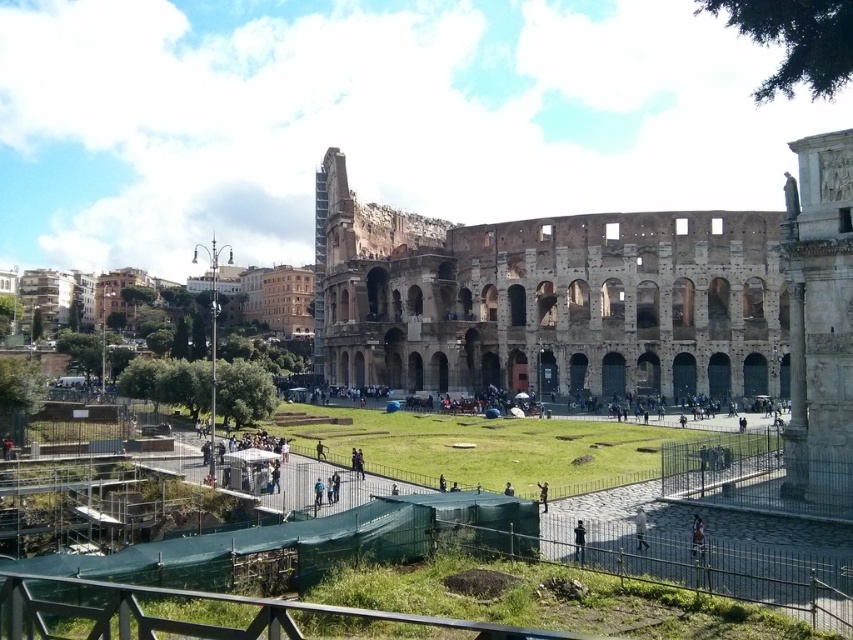
Question: Among these objects, which one is farthest from the camera?

Choices:
 (A) brown stone amphitheater at center
 (B) dark blue jeans at lower center

Answer: (A)

Question: Which point is farther to the camera?

Choices:
 (A) (641, 524)
 (B) (720, 371)
 (C) (579, 547)

Answer: (B)

Question: Among these objects, which one is nearest to the camera?

Choices:
 (A) brown stone amphitheater at center
 (B) dark blue jeans at lower center
 (C) white matte jacket at center

Answer: (B)

Question: From the image, what is the correct spatial relationship of brown stone amphitheater at center in relation to dark blue jeans at lower center?

Choices:
 (A) below
 (B) above

Answer: (B)

Question: Does white matte jacket at center have a greater width compared to dark blue jeans at lower center?

Choices:
 (A) yes
 (B) no

Answer: (B)

Question: Where is brown stone amphitheater at center located in relation to white matte jacket at center in the image?

Choices:
 (A) below
 (B) above

Answer: (B)